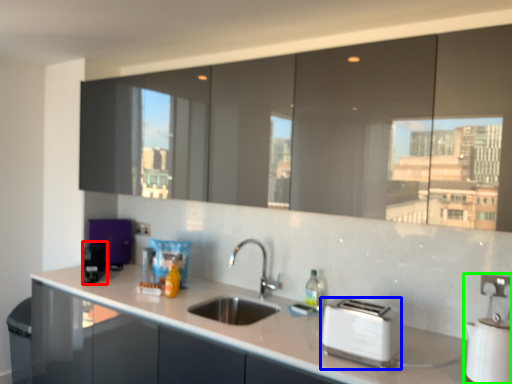
Question: Which object is positioned farthest from appliance (highlighted by a red box)? Select from toaster (highlighted by a blue box) and appliance (highlighted by a green box).

Choices:
 (A) toaster
 (B) appliance

Answer: (B)